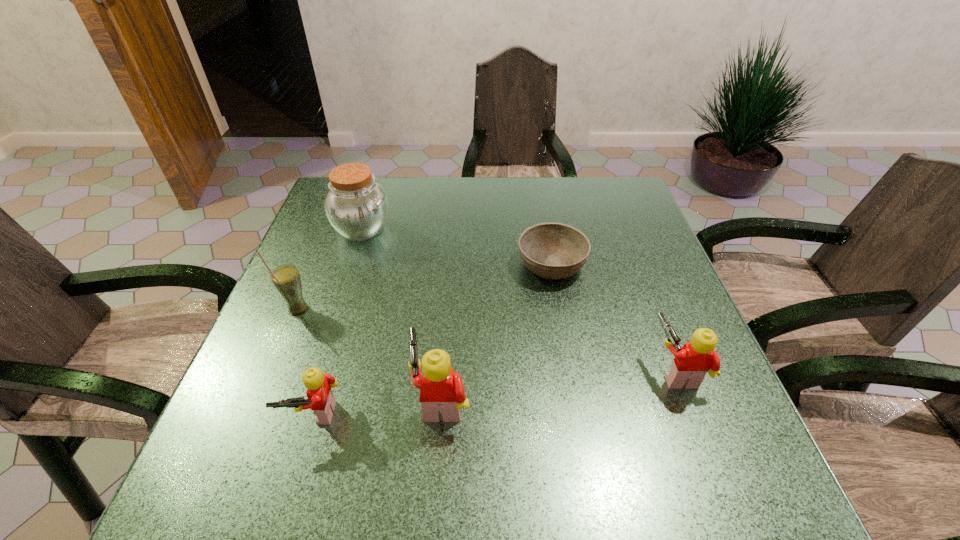
Identify the location of the shortest Lego. pyautogui.click(x=321, y=400).

Identify the location of the leftmost Lego. The height and width of the screenshot is (540, 960). (321, 400).

This screenshot has width=960, height=540. Find the location of `the second Lego from right to left`. the second Lego from right to left is located at coordinates (442, 389).

Find the location of `the rightmost object`. the rightmost object is located at coordinates (691, 363).

This screenshot has width=960, height=540. I want to click on the second tallest Lego, so click(x=691, y=363).

I want to click on the third farthest object, so (x=286, y=279).

Image resolution: width=960 pixels, height=540 pixels. I want to click on jar, so click(357, 207).

Find the location of a particular element. This screenshot has height=540, width=960. the fifth object from left to right is located at coordinates pos(551,250).

In order to click on bowl in this screenshot , I will do `click(551, 250)`.

Image resolution: width=960 pixels, height=540 pixels. I want to click on free region located 0.210m in front of the fourth object from left to right with the accessory visible, so click(300, 399).